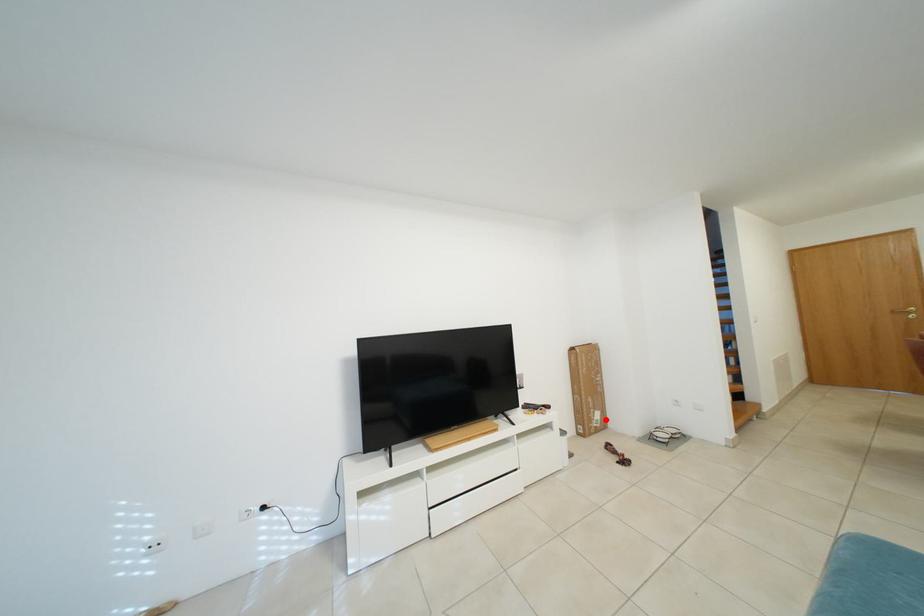
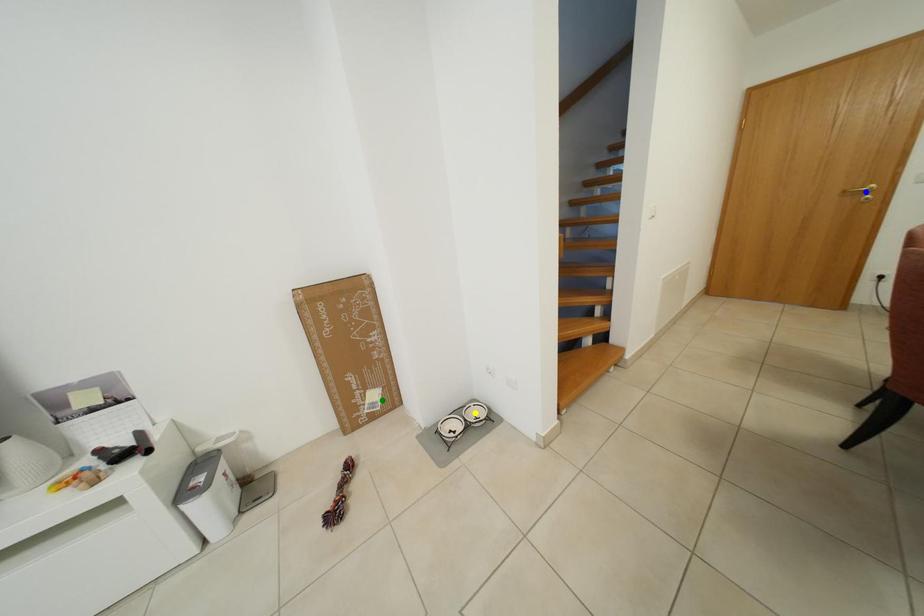
Question: I am providing you with two images of the same scene from different viewpoints. A red point is marked on the first image. You are given multiple points on the second image. Can you choose the point in image 2 that corresponds to the point in image 1?

Choices:
 (A) green point
 (B) blue point
 (C) yellow point

Answer: (A)